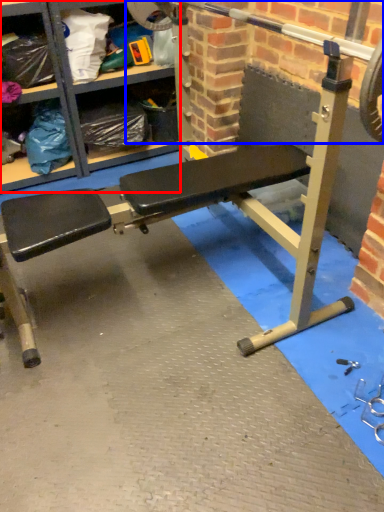
Question: Among these objects, which one is nearest to the camera, shelf (highlighted by a red box) or barbell (highlighted by a blue box)?

Choices:
 (A) shelf
 (B) barbell

Answer: (B)